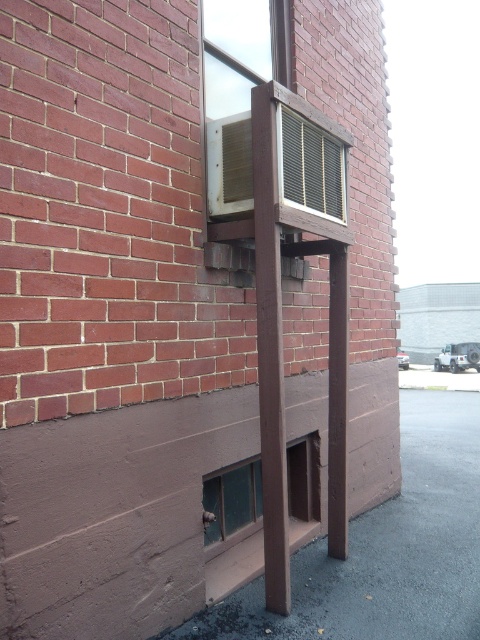
Which of these two, transparent glass hole at lower center or metallic grid window at upper center, stands shorter?

With less height is metallic grid window at upper center.

Is point (233, 490) positioned in front of point (328, 200)?

No, it is not.

Identify the location of transparent glass hole at lower center. (231, 502).

Who is higher up, metallic silver air conditioner at upper center or green glass window at lower left?

metallic silver air conditioner at upper center is higher up.

Does metallic silver air conditioner at upper center appear on the right side of green glass window at lower left?

Indeed, metallic silver air conditioner at upper center is positioned on the right side of green glass window at lower left.

Is point (240, 65) more distant than point (257, 515)?

No, it is in front of (257, 515).

Where is `metallic silver air conditioner at upper center`? metallic silver air conditioner at upper center is located at coordinates (238, 90).

Measure the distance between metallic silver air conditioner at upper center and camera.

metallic silver air conditioner at upper center is 9.58 feet from camera.

Does metallic silver air conditioner at upper center have a lesser width compared to metallic grid window at upper center?

No.

What do you see at coordinates (238, 90) in the screenshot?
I see `metallic silver air conditioner at upper center` at bounding box center [238, 90].

Image resolution: width=480 pixels, height=640 pixels. In order to click on metallic silver air conditioner at upper center in this screenshot , I will do `click(238, 90)`.